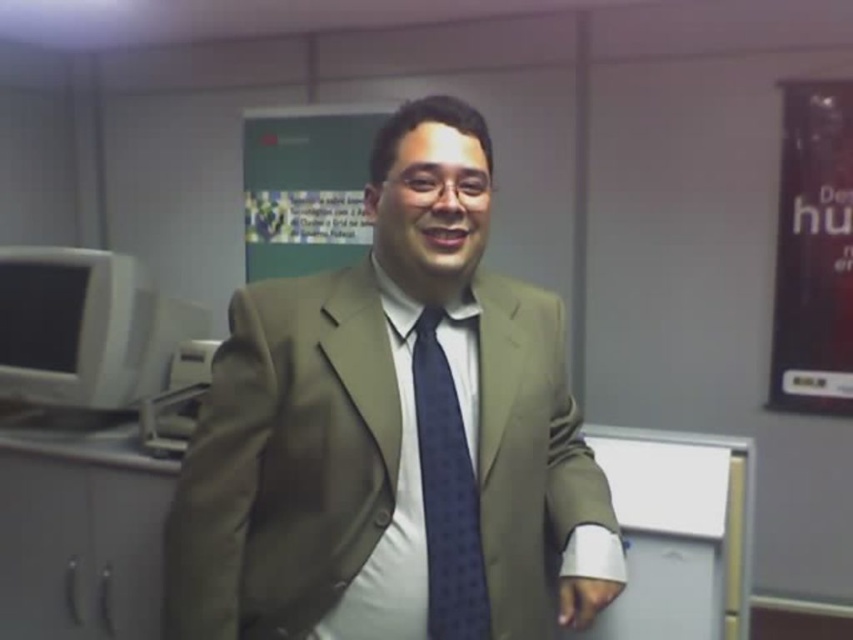
Does matte brown suit at center have a smaller size compared to matte gray monitor at left?

Actually, matte brown suit at center might be larger than matte gray monitor at left.

Looking at this image, who is taller, matte brown suit at center or matte gray monitor at left?

Standing taller between the two is matte brown suit at center.

Between point (340, 572) and point (41, 250), which one is positioned behind?

Positioned behind is point (41, 250).

Locate an element on the screen. The image size is (853, 640). matte brown suit at center is located at coordinates (393, 433).

Describe the element at coordinates (677, 532) in the screenshot. I see `white matte bulletin board at center` at that location.

Which is in front, point (596, 448) or point (364, 176)?

Positioned in front is point (596, 448).

Is point (634, 560) farther from viewer compared to point (250, 205)?

No, (634, 560) is closer to viewer.

Where is `white matte bulletin board at center`? The width and height of the screenshot is (853, 640). white matte bulletin board at center is located at coordinates (677, 532).

Does matte brown suit at center have a larger size compared to white matte bulletin board at center?

Yes, matte brown suit at center is bigger than white matte bulletin board at center.

Between matte brown suit at center and white matte bulletin board at center, which one is positioned lower?

white matte bulletin board at center

Which is in front, point (492, 513) or point (688, 582)?

Positioned in front is point (492, 513).

At what (x,y) coordinates should I click in order to perform the action: click on matte brown suit at center. Please return your answer as a coordinate pair (x, y). This screenshot has height=640, width=853. Looking at the image, I should click on (393, 433).